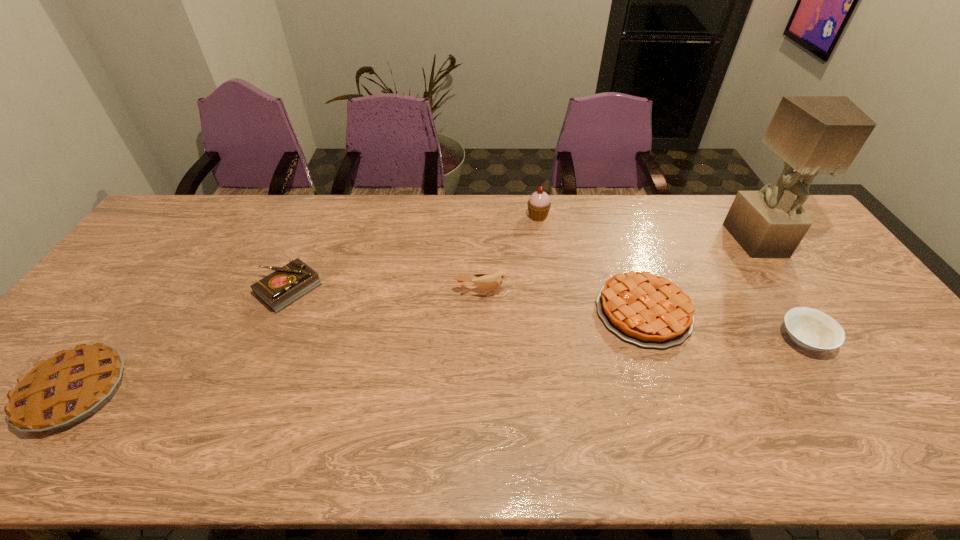
At what (x,y) coordinates should I click in order to perform the action: click on vacant area that lies between the farther pie and the bowl. Please return your answer as a coordinate pair (x, y). Looking at the image, I should click on (724, 326).

You are a GUI agent. You are given a task and a screenshot of the screen. Output one action in this format:
    pyautogui.click(x=<x>, y=<y>)
    Task: Click on the object identified as the fifth closest to the nearer pie
    Image resolution: width=960 pixels, height=540 pixels.
    Given the screenshot: What is the action you would take?
    pyautogui.click(x=812, y=329)

Identify which object is the third closest to the second tallest object. Please provide its 2D coordinates. Your answer should be formatted as a tuple, i.e. [(x, y)], where the tuple contains the x and y coordinates of a point satisfying the conditions above.

[(813, 134)]

Identify the location of vacant space that satisfies the following two spatial constraints: 1. on the front side of the diary; 2. on the left side of the farther pie. The height and width of the screenshot is (540, 960). (279, 312).